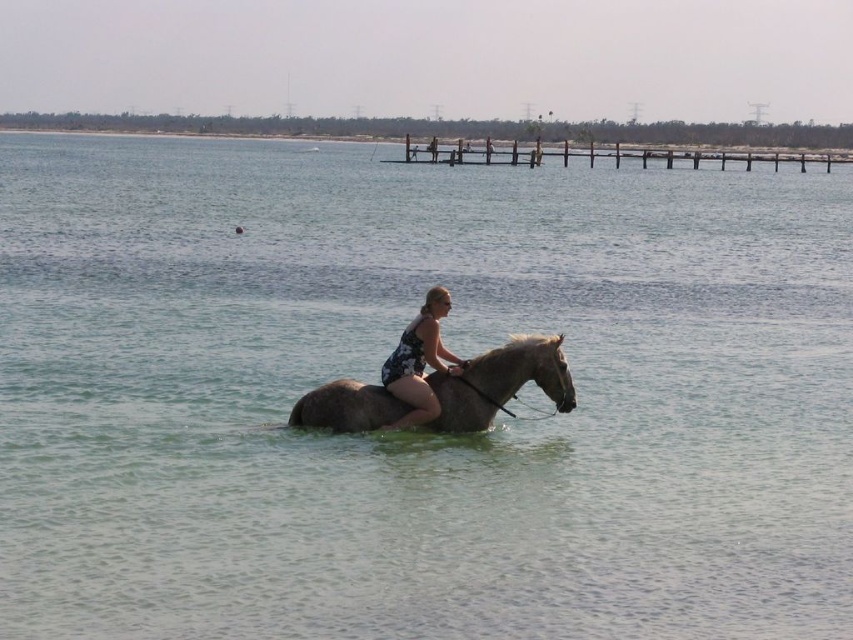
Question: Estimate the real-world distances between objects in this image. Which object is farther from the gray matte horse at center?

Choices:
 (A) wooden at upper center
 (B) floral fabric woman at center

Answer: (A)

Question: Considering the real-world distances, which object is farthest from the gray matte horse at center?

Choices:
 (A) floral fabric woman at center
 (B) wooden at upper center

Answer: (B)

Question: Is wooden at upper center smaller than floral fabric woman at center?

Choices:
 (A) no
 (B) yes

Answer: (A)

Question: Is wooden at upper center smaller than floral fabric woman at center?

Choices:
 (A) yes
 (B) no

Answer: (B)

Question: Which object appears farthest from the camera in this image?

Choices:
 (A) wooden at upper center
 (B) floral fabric woman at center

Answer: (A)

Question: Observing the image, what is the correct spatial positioning of gray matte horse at center in reference to wooden at upper center?

Choices:
 (A) left
 (B) right

Answer: (A)